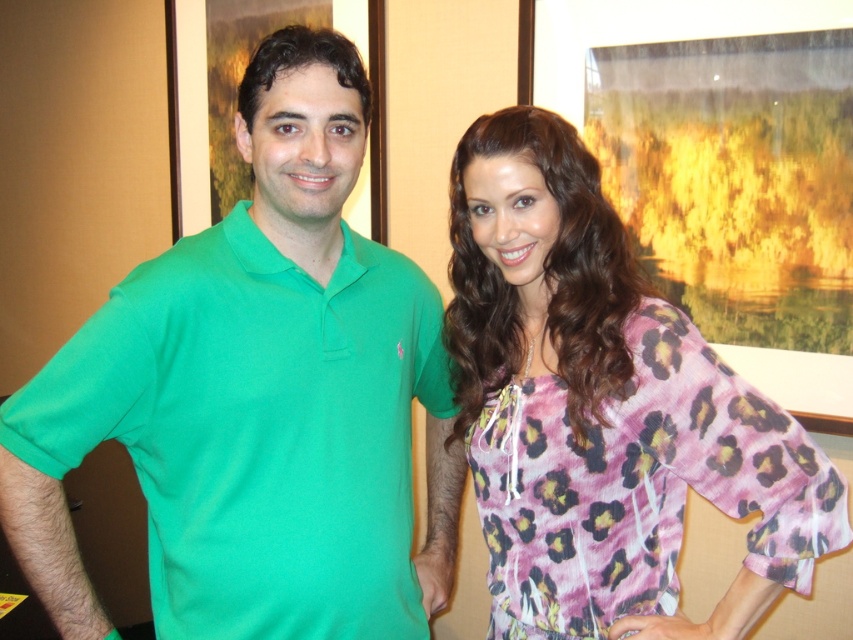
You are standing in the room and want to hand a gift to the person wearing the green polo shirt at left. Based on their position, which direction should you move to approach them?

Since the green polo shirt at left is located at point 0.622 on the horizontal axis and 0.302 on the vertical axis, you should move to the left and slightly forward to reach them.

You are a photographer setting up for a group photo. You notice the green polo shirt at left and the pink leopard print blouse at right in the frame. Which clothing item should you adjust to ensure both are fully visible in the photo?

The green polo shirt at left is positioned under the pink leopard print blouse at right, so you should adjust the pink leopard print blouse at right to move it upwards to avoid overlapping with the green polo shirt at left.

You are standing in front of a group photo and need to identify the order of the people from left to right. Which person is positioned to the left of the other between the green polo shirt at left and the pink leopard print blouse at right?

The green polo shirt at left is positioned to the left of the pink leopard print blouse at right.